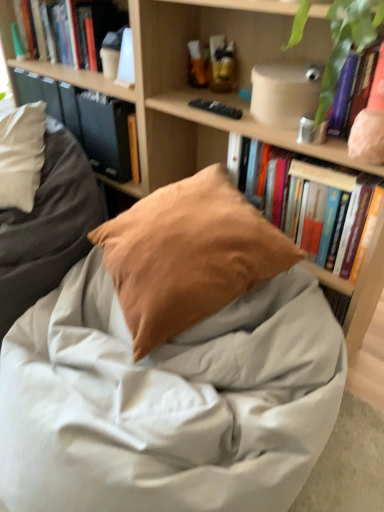
Question: Is matte brown pillow at center positioned with its back to wooden bookshelf at center?

Choices:
 (A) yes
 (B) no

Answer: (A)

Question: Is matte brown pillow at center at the right side of wooden bookshelf at center?

Choices:
 (A) no
 (B) yes

Answer: (A)

Question: Considering the relative sizes of matte brown pillow at center and wooden bookshelf at center in the image provided, is matte brown pillow at center thinner than wooden bookshelf at center?

Choices:
 (A) no
 (B) yes

Answer: (B)

Question: Does matte brown pillow at center have a larger size compared to wooden bookshelf at center?

Choices:
 (A) yes
 (B) no

Answer: (B)

Question: Does matte brown pillow at center have a greater width compared to wooden bookshelf at center?

Choices:
 (A) no
 (B) yes

Answer: (A)

Question: Is matte brown pillow at center with wooden bookshelf at center?

Choices:
 (A) no
 (B) yes

Answer: (A)

Question: Is hardcover book at upper right, placed as the second book when sorted from back to front, at the right side of hardcover book at upper left?

Choices:
 (A) no
 (B) yes

Answer: (B)

Question: From the image's perspective, is hardcover book at upper right, marked as the first book in a right-to-left arrangement, below hardcover book at upper left?

Choices:
 (A) yes
 (B) no

Answer: (A)

Question: Is hardcover book at upper right, placed as the second book when sorted from back to front, directly adjacent to hardcover book at upper left?

Choices:
 (A) yes
 (B) no

Answer: (B)

Question: Considering the relative sizes of hardcover book at upper right, marked as the first book in a right-to-left arrangement, and hardcover book at upper left in the image provided, is hardcover book at upper right, marked as the first book in a right-to-left arrangement, taller than hardcover book at upper left?

Choices:
 (A) no
 (B) yes

Answer: (A)

Question: From a real-world perspective, is hardcover book at upper right, positioned as the second book in top-to-bottom order, physically below hardcover book at upper left?

Choices:
 (A) no
 (B) yes

Answer: (B)

Question: Can you confirm if hardcover book at upper right, positioned as the second book in top-to-bottom order, is bigger than hardcover book at upper left?

Choices:
 (A) yes
 (B) no

Answer: (A)

Question: From the image's perspective, is hardcover book at upper left, arranged as the 1th book when viewed from the top, beneath hardcover book at upper right, placed as the second book when sorted from back to front?

Choices:
 (A) yes
 (B) no

Answer: (B)